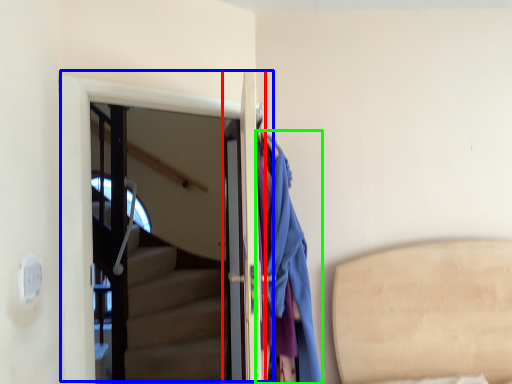
Question: Which object is positioned farthest from door (highlighted by a red box)? Select from door (highlighted by a blue box) and clothing (highlighted by a green box).

Choices:
 (A) door
 (B) clothing

Answer: (A)